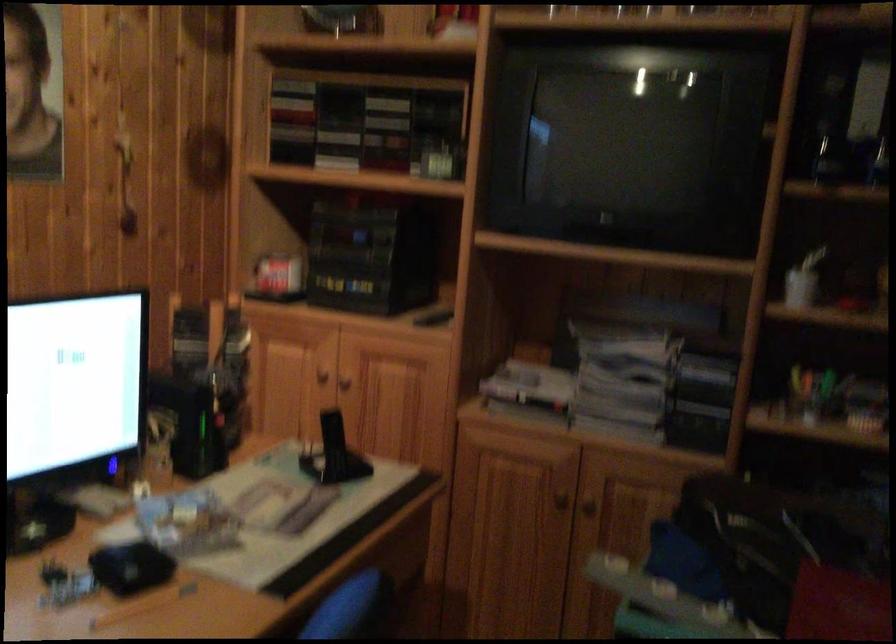
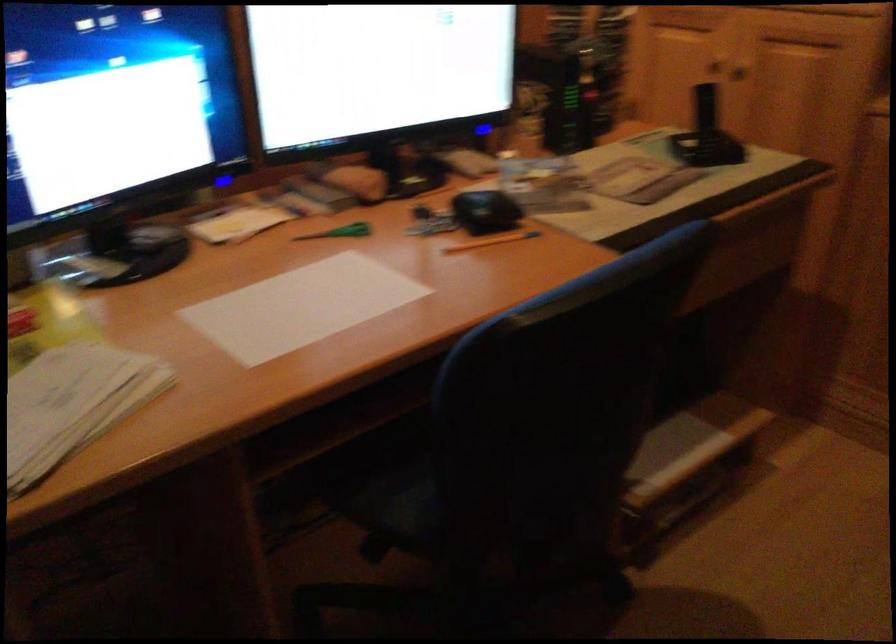
Locate, in the second image, the point that corresponds to pixel 135 569 in the first image.

(486, 211)